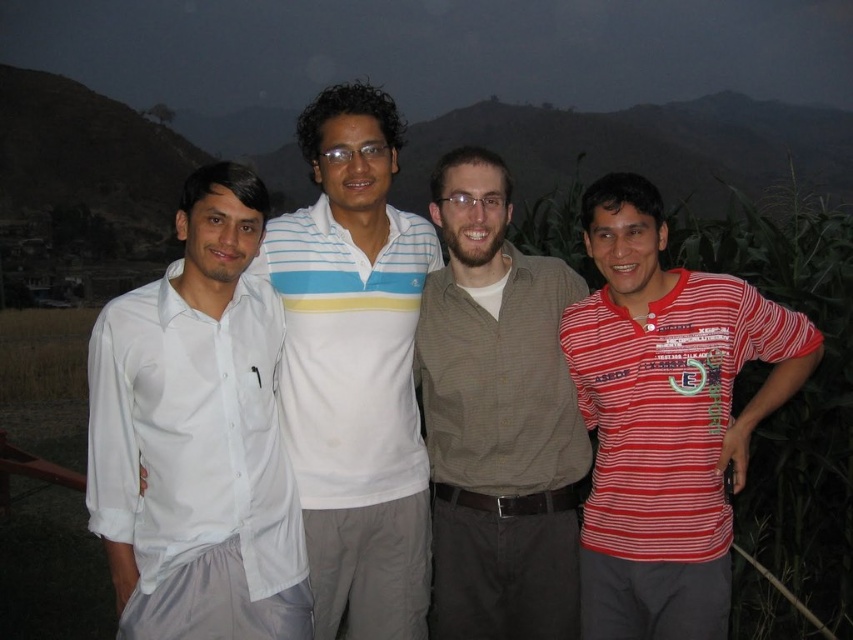
Can you confirm if white striped polo shirt at center is bigger than white cotton shirt at left?

Yes.

Is white striped polo shirt at center smaller than white cotton shirt at left?

Actually, white striped polo shirt at center might be larger than white cotton shirt at left.

Between point (370, 144) and point (209, 440), which one is positioned in front?

Point (209, 440) is in front.

You are a GUI agent. You are given a task and a screenshot of the screen. Output one action in this format:
    pyautogui.click(x=<x>, y=<y>)
    Task: Click on the white striped polo shirt at center
    This screenshot has height=640, width=853.
    Given the screenshot: What is the action you would take?
    pyautogui.click(x=355, y=369)

Who is shorter, brown textured shirt at center or white cotton shirt at left?

white cotton shirt at left is shorter.

This screenshot has height=640, width=853. In order to click on brown textured shirt at center in this screenshot , I will do `click(498, 419)`.

Identify the location of brown textured shirt at center. Image resolution: width=853 pixels, height=640 pixels. (498, 419).

Can you confirm if red striped shirt at right is smaller than brown textured shirt at center?

Actually, red striped shirt at right might be larger than brown textured shirt at center.

Consider the image. Between red striped shirt at right and brown textured shirt at center, which one has less height?

red striped shirt at right

Who is more forward, (688, 592) or (474, 200)?

Point (688, 592) is in front.

Locate an element on the screen. red striped shirt at right is located at coordinates (665, 419).